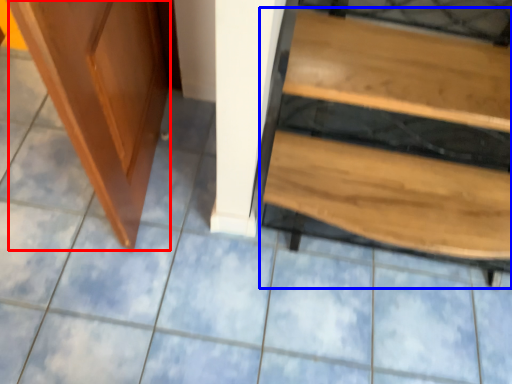
Question: Which object appears closest to the camera in this image, screen door (highlighted by a red box) or furniture (highlighted by a blue box)?

Choices:
 (A) screen door
 (B) furniture

Answer: (A)